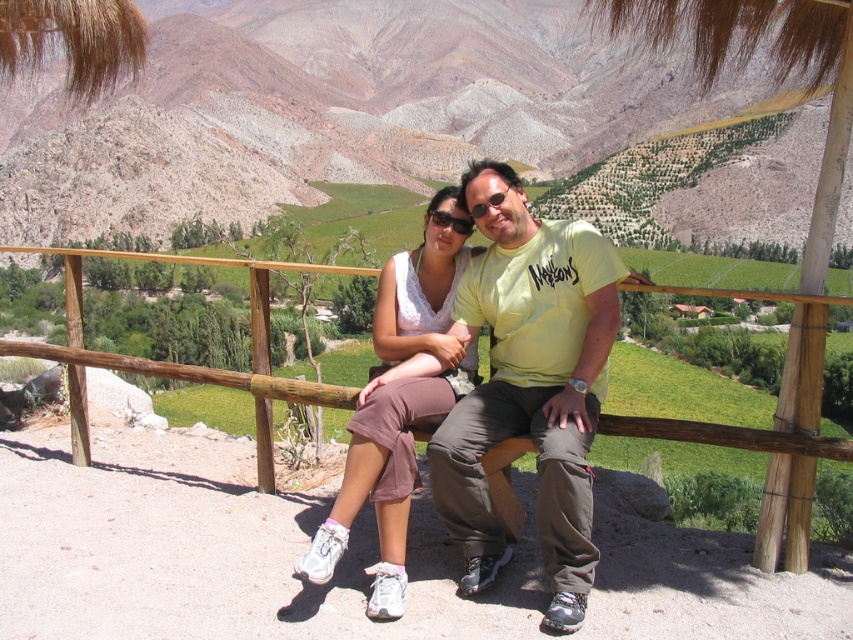
Question: Does matte white tank top at center have a lesser width compared to wooden rail at center?

Choices:
 (A) no
 (B) yes

Answer: (B)

Question: Does yellow cotton t-shirt at center come behind matte white tank top at center?

Choices:
 (A) no
 (B) yes

Answer: (A)

Question: Observing the image, what is the correct spatial positioning of rustic stone mountains at upper center in reference to yellow cotton t-shirt at center?

Choices:
 (A) above
 (B) below

Answer: (A)

Question: Which of these objects is positioned farthest from the yellow cotton t-shirt at center?

Choices:
 (A) rustic stone mountains at upper center
 (B) wooden rail at center
 (C) matte white tank top at center

Answer: (A)

Question: Which of the following is the farthest from the observer?

Choices:
 (A) (149, 369)
 (B) (590, 234)
 (C) (770, 188)

Answer: (C)

Question: Which of these objects is positioned closest to the yellow cotton t-shirt at center?

Choices:
 (A) rustic stone mountains at upper center
 (B) wooden rail at center
 (C) matte white tank top at center

Answer: (C)